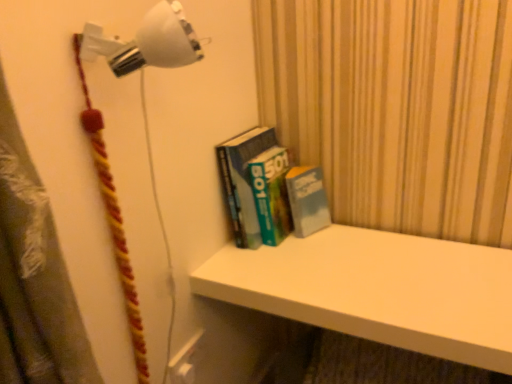
Question: Considering the relative sizes of hardcover books at center and white plastic lamp at upper left, which ranks as the 2th lamp in top-to-bottom order, in the image provided, is hardcover books at center bigger than white plastic lamp at upper left, which ranks as the 2th lamp in top-to-bottom order,?

Choices:
 (A) no
 (B) yes

Answer: (B)

Question: Does hardcover books at center have a greater height compared to white plastic lamp at upper left, which ranks as the 2th lamp in top-to-bottom order?

Choices:
 (A) no
 (B) yes

Answer: (A)

Question: Does hardcover books at center have a smaller size compared to white plastic lamp at upper left, which ranks as the 2th lamp in top-to-bottom order?

Choices:
 (A) yes
 (B) no

Answer: (B)

Question: Is hardcover books at center thinner than white plastic lamp at upper left, which is counted as the first lamp, starting from the bottom?

Choices:
 (A) yes
 (B) no

Answer: (B)

Question: Is hardcover books at center in contact with white plastic lamp at upper left, which is counted as the first lamp, starting from the bottom?

Choices:
 (A) yes
 (B) no

Answer: (B)

Question: Considering the relative sizes of hardcover books at center and white plastic lamp at upper left, which ranks as the 2th lamp in top-to-bottom order, in the image provided, is hardcover books at center shorter than white plastic lamp at upper left, which ranks as the 2th lamp in top-to-bottom order,?

Choices:
 (A) no
 (B) yes

Answer: (B)

Question: Is white matte shelf at upper center smaller than white plastic lamp at upper left, which is counted as the first lamp, starting from the bottom?

Choices:
 (A) yes
 (B) no

Answer: (B)

Question: Is white matte shelf at upper center further to camera compared to white plastic lamp at upper left, which ranks as the 2th lamp in top-to-bottom order?

Choices:
 (A) no
 (B) yes

Answer: (B)

Question: From the image's perspective, is white matte shelf at upper center located beneath white plastic lamp at upper left, which is counted as the first lamp, starting from the bottom?

Choices:
 (A) no
 (B) yes

Answer: (B)

Question: Considering the relative positions of white matte shelf at upper center and white plastic lamp at upper left, which is counted as the first lamp, starting from the bottom, in the image provided, is white matte shelf at upper center in front of white plastic lamp at upper left, which is counted as the first lamp, starting from the bottom,?

Choices:
 (A) yes
 (B) no

Answer: (B)

Question: Is white matte shelf at upper center not within white plastic lamp at upper left, which ranks as the 2th lamp in top-to-bottom order?

Choices:
 (A) no
 (B) yes

Answer: (B)

Question: Considering the relative sizes of white matte shelf at upper center and white plastic lamp at upper left, which is counted as the first lamp, starting from the bottom, in the image provided, is white matte shelf at upper center bigger than white plastic lamp at upper left, which is counted as the first lamp, starting from the bottom,?

Choices:
 (A) yes
 (B) no

Answer: (A)

Question: Would you consider white plastic lamp at upper left, which is counted as the first lamp, starting from the bottom, to be distant from white matte shelf at upper center?

Choices:
 (A) no
 (B) yes

Answer: (A)